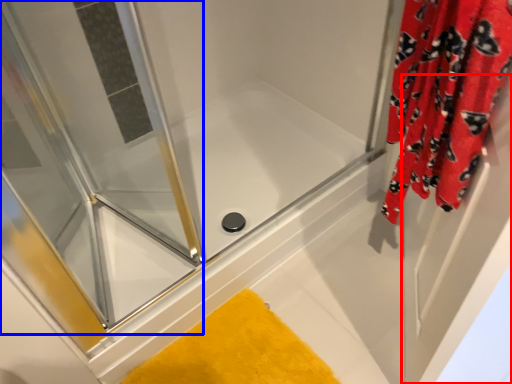
Question: Among these objects, which one is farthest to the camera, screen door (highlighted by a red box) or screen door (highlighted by a blue box)?

Choices:
 (A) screen door
 (B) screen door

Answer: (B)